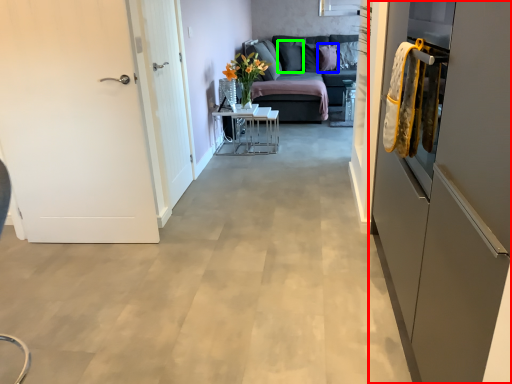
Question: Which object is positioned farthest from cabinetry (highlighted by a red box)? Select from pillow (highlighted by a blue box) and pillow (highlighted by a green box).

Choices:
 (A) pillow
 (B) pillow

Answer: (B)